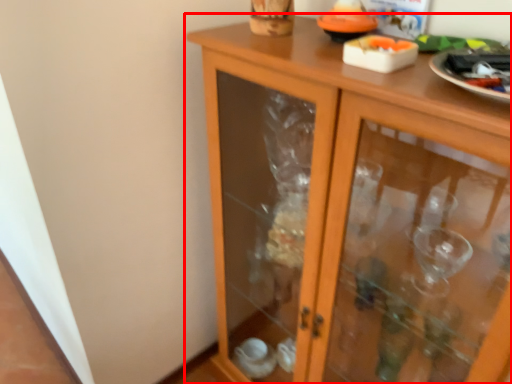
Question: Where is cupboard (annotated by the red box) located in relation to glass plate in the image?

Choices:
 (A) left
 (B) right

Answer: (A)